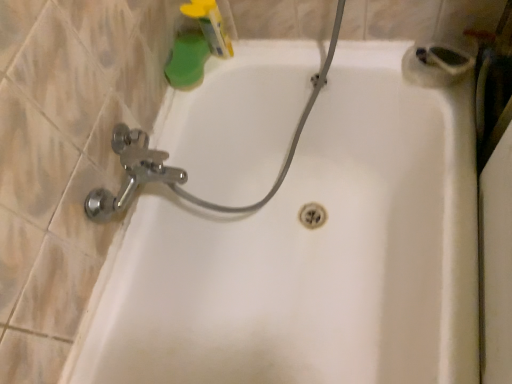
Question: Should I look upward or downward to see white plastic shower at upper right?

Choices:
 (A) up
 (B) down

Answer: (A)